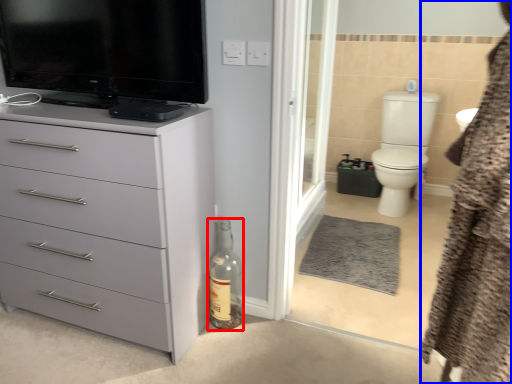
Question: Which object is further to the camera taking this photo, bottle (highlighted by a red box) or bathrobe (highlighted by a blue box)?

Choices:
 (A) bottle
 (B) bathrobe

Answer: (A)